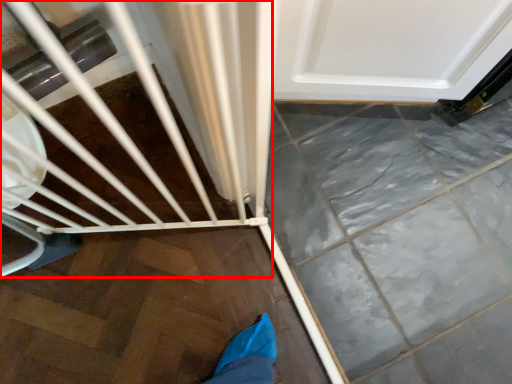
Question: From the image's perspective, what is the correct spatial positioning of baby carriage (annotated by the red box) in reference to door?

Choices:
 (A) below
 (B) above

Answer: (A)